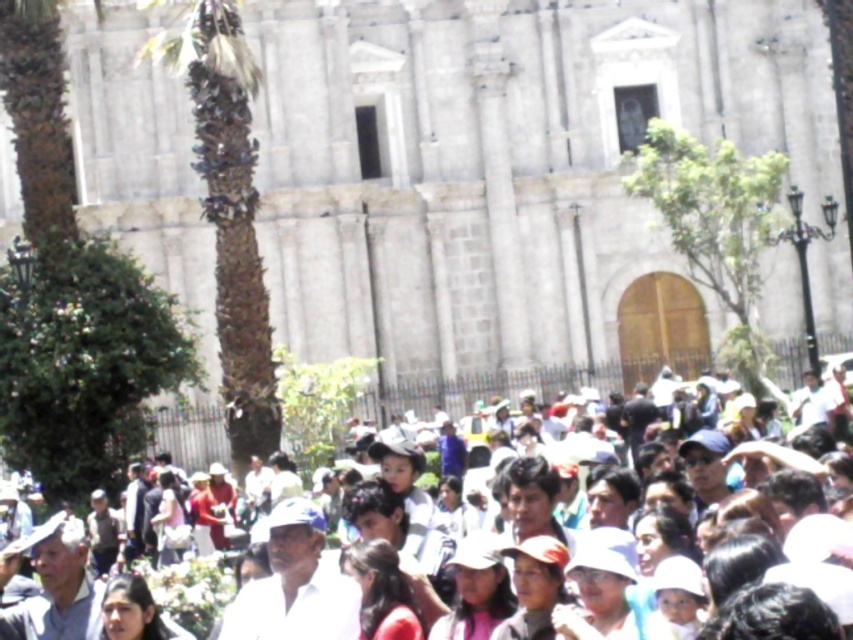
You are a photographer wanting to capture both the green leafy palm tree at left and the white clothed crowd at center in a single frame. Which object should you focus on first to ensure both are visible in your photo?

Since the green leafy palm tree at left occupies less space than the white clothed crowd at center, you should focus on the white clothed crowd at center first to ensure both are visible in the photo.

You are a photographer trying to capture a clear shot of the historic building. You notice the green leafy palm tree at left and the white clothed crowd at center. Which object is narrower so that it won

The green leafy palm tree at left is thinner than the white clothed crowd at center, so the palm tree is narrower and less likely to block your view of the building.

You are standing in front of the historic stone building and want to take a photo of the green leafy palm tree at left without the white clothed crowd at center blocking the view. Is the palm tree visible from your current position?

The white clothed crowd at center is behind the green leafy palm tree at left, so the palm tree is visible without obstruction from the crowd.